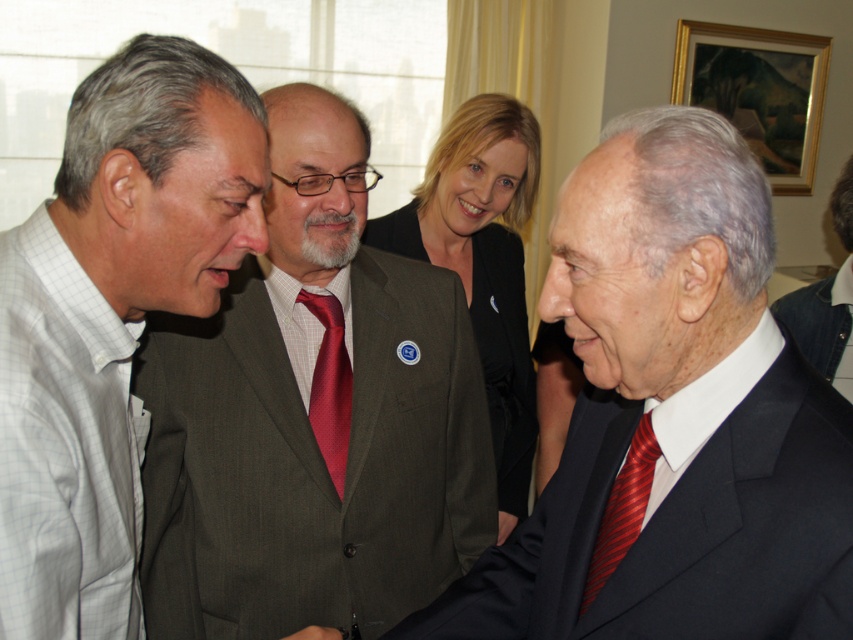
Question: Is matte gray suit at center in front of matte black blazer at center?

Choices:
 (A) yes
 (B) no

Answer: (A)

Question: Can you confirm if matte gray suit at center is wider than matte black blazer at center?

Choices:
 (A) no
 (B) yes

Answer: (B)

Question: Which point appears farthest from the camera in this image?

Choices:
 (A) (846, 220)
 (B) (236, 120)
 (C) (335, 472)

Answer: (A)

Question: Which is farther from the matte gray suit at center?

Choices:
 (A) dark gray suit at right
 (B) gray checkered shirt at left
 (C) smooth skin hand at lower left

Answer: (A)

Question: Which point is closer to the camera?

Choices:
 (A) matte gray suit at center
 (B) dark gray suit at right
 (C) matte black suit at center

Answer: (C)

Question: Is matte black suit at center behind gray checkered shirt at left?

Choices:
 (A) no
 (B) yes

Answer: (A)